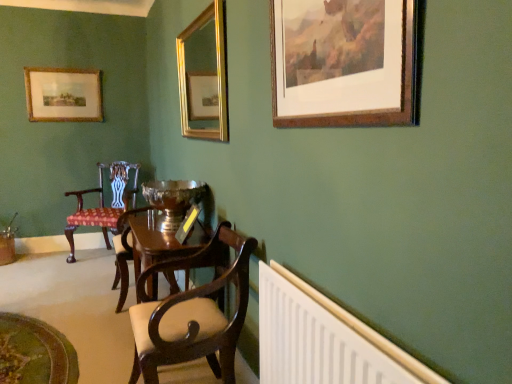
Find the location of a particular element. The height and width of the screenshot is (384, 512). free spot above wooden picture frame at upper left, the 1th picture frame from the left (from a real-world perspective) is located at coordinates (58, 68).